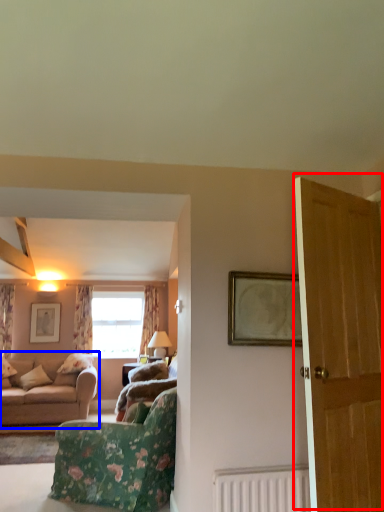
Question: Which of the following is the closest to the observer, door (highlighted by a red box) or studio couch (highlighted by a blue box)?

Choices:
 (A) door
 (B) studio couch

Answer: (A)